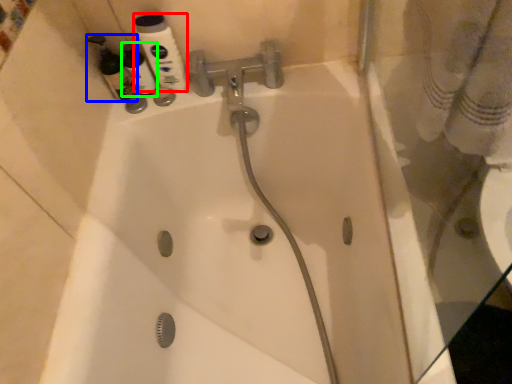
Question: Considering the real-world distances, which object is farthest from mouthwash (highlighted by a red box)? cleaning product (highlighted by a blue box) or cleaning product (highlighted by a green box)?

Choices:
 (A) cleaning product
 (B) cleaning product

Answer: (A)